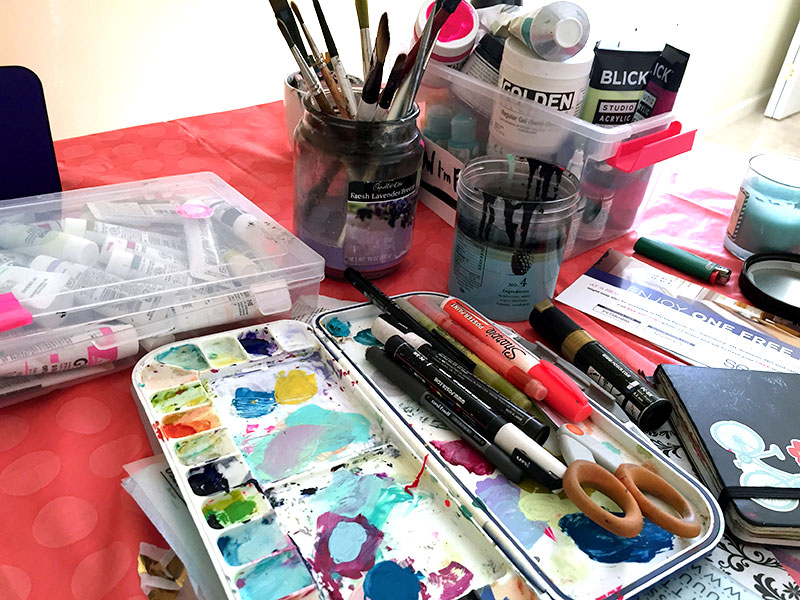
You are a GUI agent. You are given a task and a screenshot of the screen. Output one action in this format:
    pyautogui.click(x=<x>, y=<y>)
    Task: Click on the background: red table cloth
    
    Given the screenshot: What is the action you would take?
    pos(48,491)